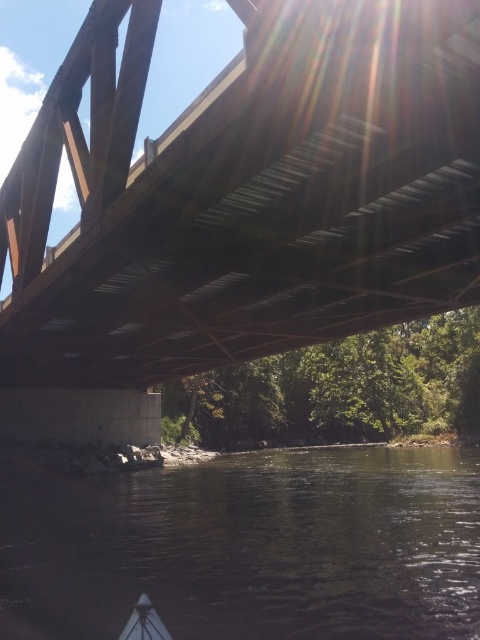
Can you confirm if dark water at lower center is taller than white plastic boat at lower center?

Yes.

Between dark water at lower center and white plastic boat at lower center, which one appears on the left side from the viewer's perspective?

white plastic boat at lower center is more to the left.

I want to click on dark water at lower center, so click(249, 547).

Where is `dark water at lower center`? dark water at lower center is located at coordinates (249, 547).

Does point (459, 93) come in front of point (153, 611)?

That is False.

Which is above, metallic brown bridge at upper center or white plastic boat at lower center?

Positioned higher is metallic brown bridge at upper center.

Does point (75, 355) lie behind point (120, 632)?

Yes, it is.

Find the location of a particular element. metallic brown bridge at upper center is located at coordinates (248, 193).

Between metallic brown bridge at upper center and dark water at lower center, which one is positioned lower?

dark water at lower center is below.

Does metallic brown bridge at upper center have a lesser height compared to dark water at lower center?

Incorrect, metallic brown bridge at upper center's height does not fall short of dark water at lower center's.

Measure the distance between metallic brown bridge at upper center and camera.

metallic brown bridge at upper center is 4.38 meters from camera.

Identify the location of metallic brown bridge at upper center. The height and width of the screenshot is (640, 480). (248, 193).